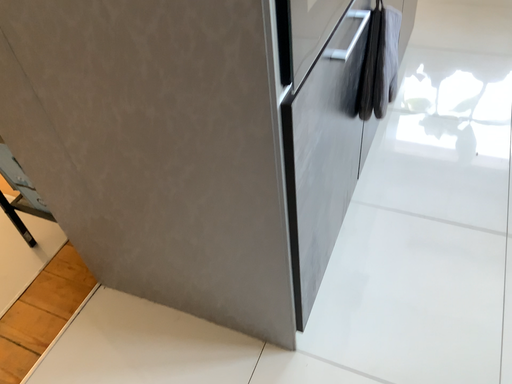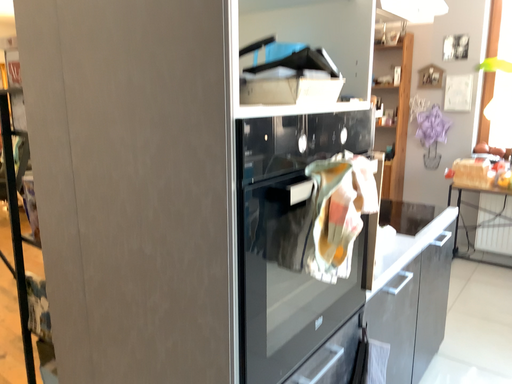
Question: How did the camera likely rotate when shooting the video?

Choices:
 (A) rotated downward
 (B) rotated upward

Answer: (B)